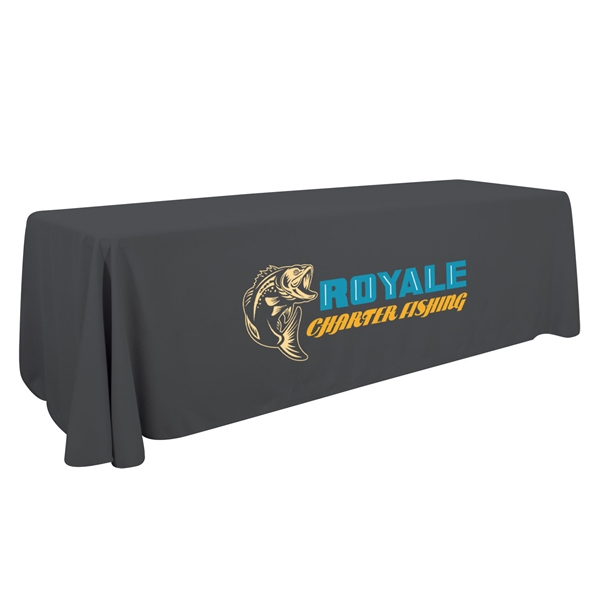
Identify the location of table top. (53, 213), (105, 238), (302, 205), (457, 180), (556, 193).